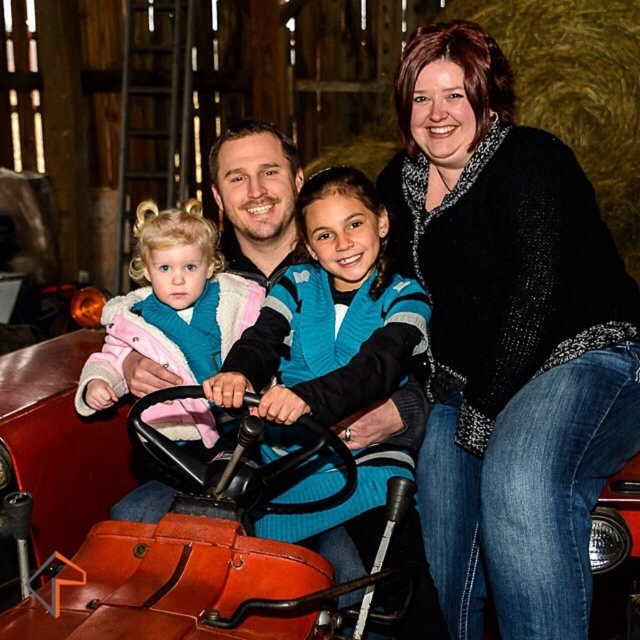
You are standing in front of the image and want to locate the black textured sweater at upper right. According to the coordinates provided, where exactly is it positioned?

The black textured sweater at upper right is located at point 0.533 on the x axis and 0.794 on the y axis.

You are a photographer trying to capture a photo of the family. The black textured sweater at upper right and the matte teal vest at center are in your viewfinder. Which clothing item will appear larger in the photo?

The black textured sweater at upper right will appear larger in the photo because it is much taller than the matte teal vest at center.